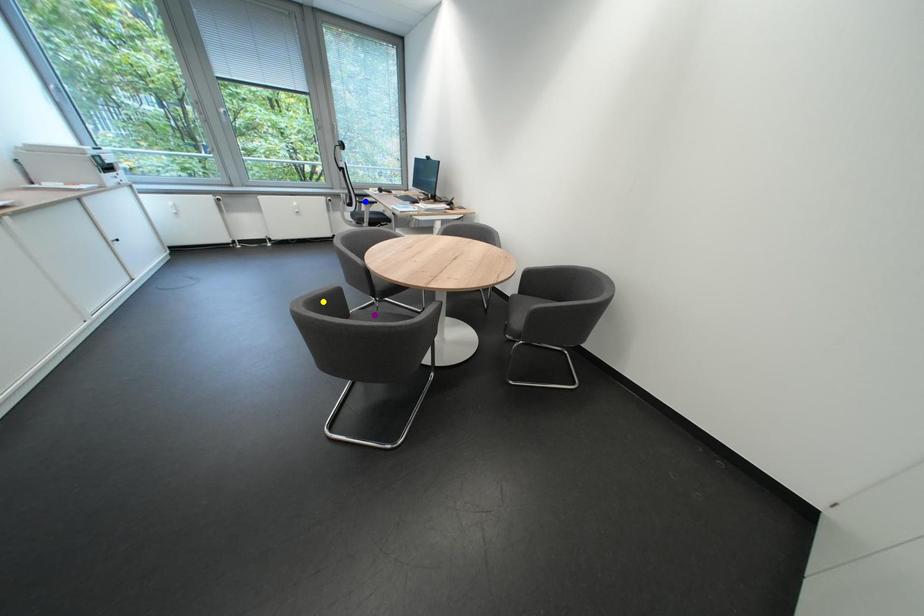
Order these from nearest to farthest:
blue point, yellow point, purple point

purple point, yellow point, blue point